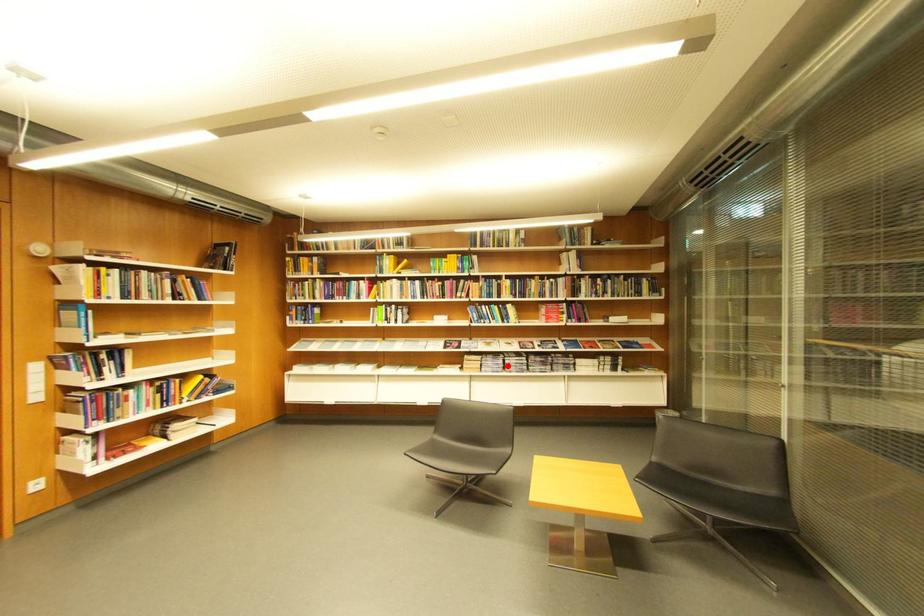
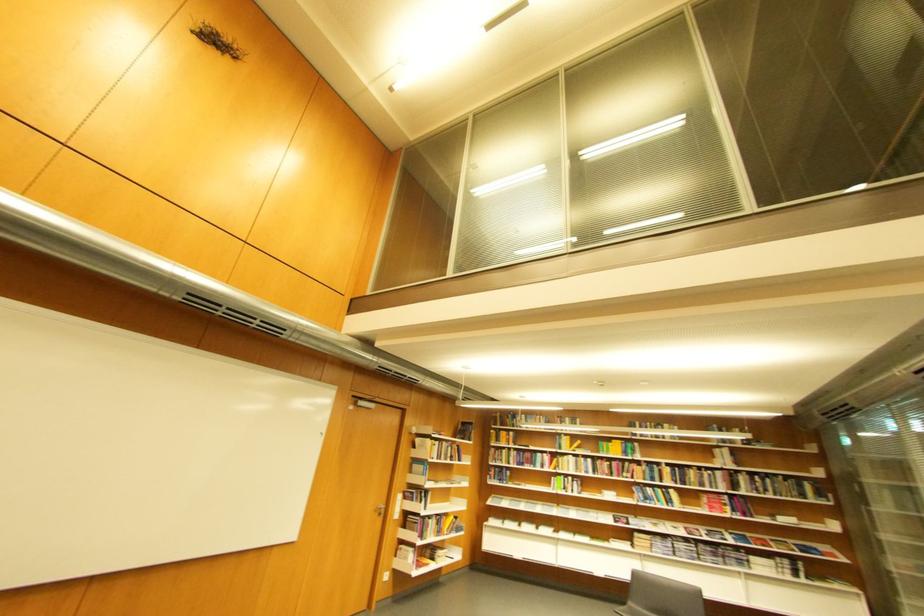
Question: A red point is marked in image1. In image2, is the corresponding 3D point closer to the camera or farther? Reply with the corresponding letter.

Choices:
 (A) The corresponding 3D point is closer.
 (B) The corresponding 3D point is farther.

Answer: (A)